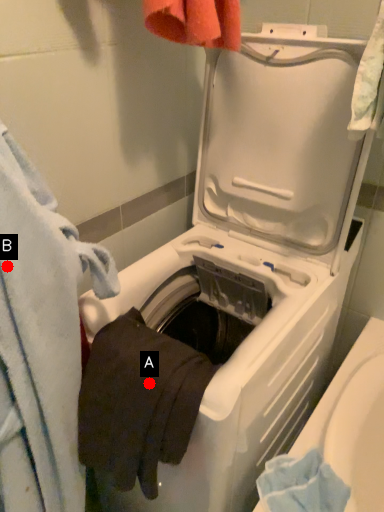
Question: Two points are circled on the image, labeled by A and B beside each circle. Which point is further to the camera?

Choices:
 (A) A is further
 (B) B is further

Answer: (A)